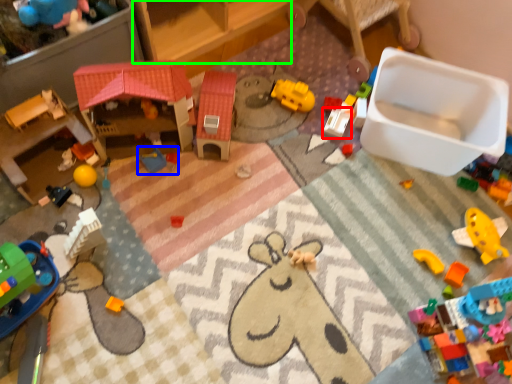
Question: Which object is positioned closest to toy (highlighted by a red box)? Select from toy (highlighted by a blue box) and furniture (highlighted by a green box).

Choices:
 (A) toy
 (B) furniture

Answer: (B)